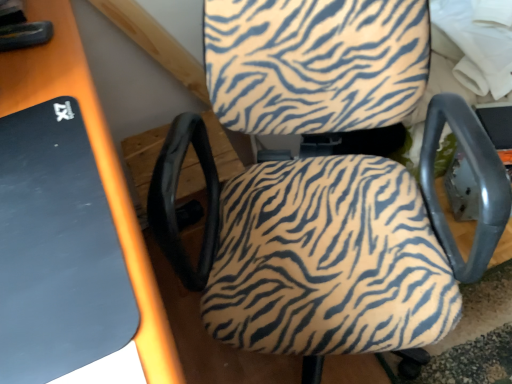
Question: From the image's perspective, would you say black matte mousepad at left is positioned over zebra-patterned fabric chair at center?

Choices:
 (A) yes
 (B) no

Answer: (B)

Question: Can you confirm if black matte mousepad at left is wider than zebra-patterned fabric chair at center?

Choices:
 (A) no
 (B) yes

Answer: (A)

Question: Does black matte mousepad at left have a lesser height compared to zebra-patterned fabric chair at center?

Choices:
 (A) yes
 (B) no

Answer: (A)

Question: Does black matte mousepad at left have a smaller size compared to zebra-patterned fabric chair at center?

Choices:
 (A) yes
 (B) no

Answer: (A)

Question: Can you confirm if black matte mousepad at left is bigger than zebra-patterned fabric chair at center?

Choices:
 (A) yes
 (B) no

Answer: (B)

Question: From a real-world perspective, is black matte mousepad at left on zebra-patterned fabric chair at center?

Choices:
 (A) yes
 (B) no

Answer: (A)

Question: Does zebra-patterned fabric chair at center have a greater height compared to black matte mousepad at left?

Choices:
 (A) yes
 (B) no

Answer: (A)

Question: Is zebra-patterned fabric chair at center closer to the viewer compared to black matte mousepad at left?

Choices:
 (A) yes
 (B) no

Answer: (A)

Question: Can you confirm if zebra-patterned fabric chair at center is shorter than black matte mousepad at left?

Choices:
 (A) yes
 (B) no

Answer: (B)

Question: From a real-world perspective, is zebra-patterned fabric chair at center on top of black matte mousepad at left?

Choices:
 (A) no
 (B) yes

Answer: (A)

Question: Considering the relative positions of zebra-patterned fabric chair at center and black matte mousepad at left in the image provided, is zebra-patterned fabric chair at center to the left of black matte mousepad at left from the viewer's perspective?

Choices:
 (A) yes
 (B) no

Answer: (B)

Question: Can you confirm if zebra-patterned fabric chair at center is thinner than black matte mousepad at left?

Choices:
 (A) yes
 (B) no

Answer: (B)

Question: From a real-world perspective, relative to zebra-patterned fabric chair at center, is black matte mousepad at left vertically above or below?

Choices:
 (A) above
 (B) below

Answer: (A)